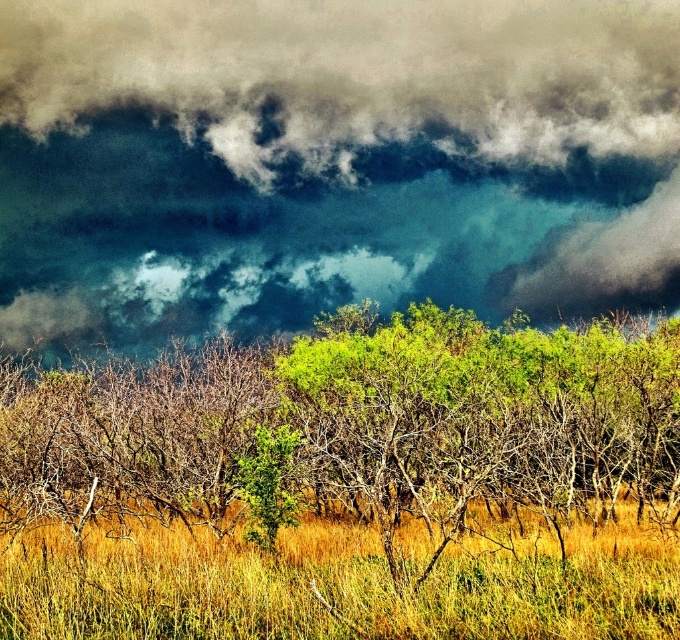
Question: Which point is farther from the camera taking this photo?

Choices:
 (A) (120, 81)
 (B) (309, 420)
 (C) (105, 541)

Answer: (A)

Question: Does green leafy tree at center appear over yellow grassy at center?

Choices:
 (A) no
 (B) yes

Answer: (B)

Question: Which of the following is the closest to the observer?

Choices:
 (A) dark cloud at upper center
 (B) green leafy tree at center
 (C) yellow grassy at center

Answer: (C)

Question: Is dark cloud at upper center below green leafy tree at center?

Choices:
 (A) yes
 (B) no

Answer: (B)

Question: Which is nearer to the yellow grassy at center?

Choices:
 (A) dark cloud at upper center
 (B) green leafy tree at center

Answer: (B)

Question: Does dark cloud at upper center lie in front of yellow grassy at center?

Choices:
 (A) yes
 (B) no

Answer: (B)